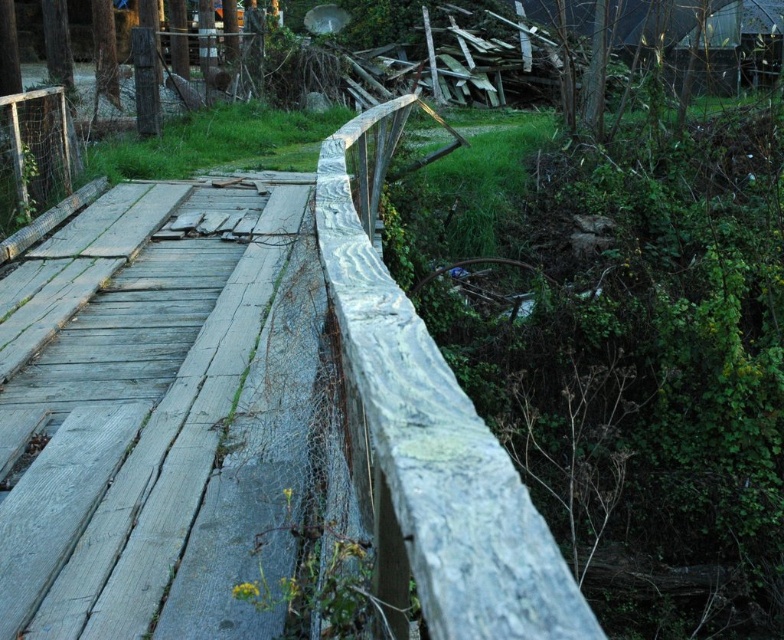
Question: Can you confirm if weathered wood planks at center is positioned below weathered wood rail at center?

Choices:
 (A) yes
 (B) no

Answer: (A)

Question: Where is weathered wood planks at center located in relation to weathered wood rail at center in the image?

Choices:
 (A) below
 (B) above

Answer: (A)

Question: Does weathered wood planks at center appear on the left side of weathered wood rail at center?

Choices:
 (A) no
 (B) yes

Answer: (B)

Question: Among these objects, which one is nearest to the camera?

Choices:
 (A) weathered wood rail at center
 (B) weathered wood planks at center

Answer: (A)

Question: Which point is farther to the camera?

Choices:
 (A) weathered wood rail at center
 (B) weathered wood planks at center

Answer: (B)